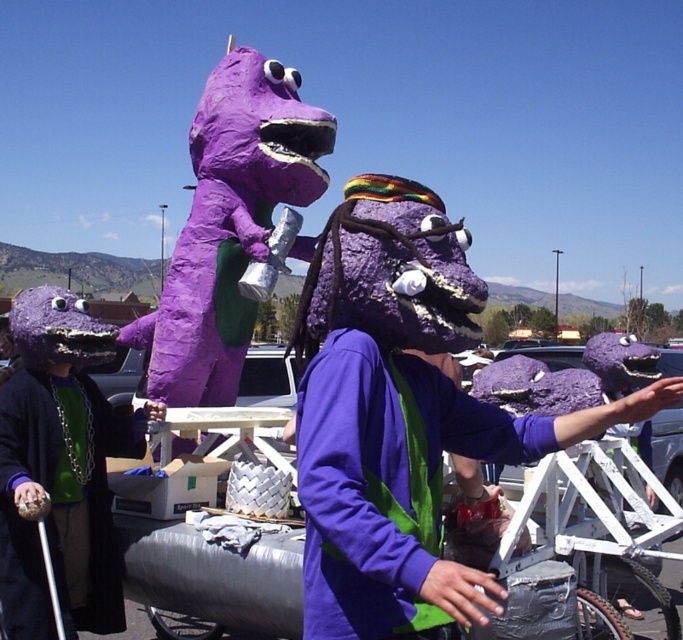
Between purple papier-mâché mask at center and matte purple costume at left, which one is positioned lower?

matte purple costume at left is lower down.

Is purple papier-mâché mask at center below matte purple costume at left?

No, purple papier-mâché mask at center is not below matte purple costume at left.

Identify the location of purple papier-mâché mask at center. (402, 417).

Where is `purple papier-mâché mask at center`? The height and width of the screenshot is (640, 683). purple papier-mâché mask at center is located at coordinates (402, 417).